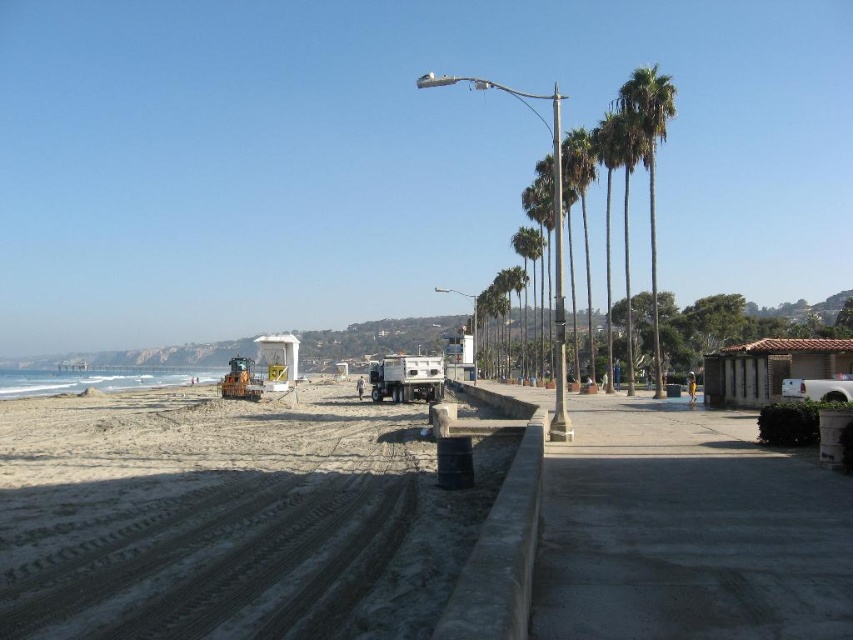
Question: Can you confirm if green leafy palm trees at upper right is positioned above green leafy palm trees at right?

Choices:
 (A) no
 (B) yes

Answer: (B)

Question: Which is nearer to the green leafy palm trees at right?

Choices:
 (A) green leafy palm tree at center
 (B) white matte camper at center

Answer: (A)

Question: Is green leafy palm trees at center-right above green leafy palm tree at center?

Choices:
 (A) yes
 (B) no

Answer: (A)

Question: Does light brown sand at lower left have a lesser width compared to green leafy palm trees at center?

Choices:
 (A) yes
 (B) no

Answer: (A)

Question: Which of the following is the farthest from the observer?

Choices:
 (A) green leafy palm trees at center-right
 (B) white matte camper at center
 (C) green leafy palm trees at right

Answer: (B)

Question: Based on their relative distances, which object is farther from the green leafy palm tree at center-right?

Choices:
 (A) light brown sand at lower left
 (B) green leafy palm trees at center

Answer: (A)